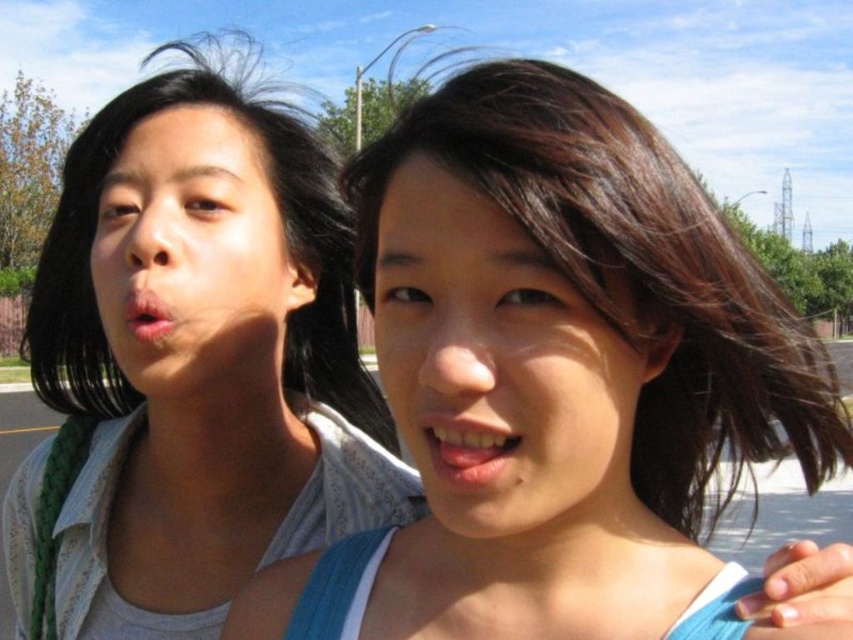
Between point (461, 337) and point (427, 417), which one is positioned behind?

The point (427, 417) is more distant.

Is smooth skin face at center further to the viewer compared to pink glossy lips at center?

No, it is not.

At what (x,y) coordinates should I click in order to perform the action: click on smooth skin face at center. Please return your answer as a coordinate pair (x, y). The height and width of the screenshot is (640, 853). Looking at the image, I should click on (500, 369).

Does smooth brown hair at center have a larger size compared to pink matte lips at center?

Yes, smooth brown hair at center is bigger than pink matte lips at center.

Which of these two, smooth brown hair at center or pink matte lips at center, stands taller?

Standing taller between the two is smooth brown hair at center.

Identify the location of smooth brown hair at center. (558, 378).

Which is behind, point (202, 392) or point (492, 470)?

Point (202, 392)

Where is `smooth skin face at left`? The image size is (853, 640). smooth skin face at left is located at coordinates (193, 257).

The width and height of the screenshot is (853, 640). In order to click on smooth skin face at left in this screenshot , I will do `click(193, 257)`.